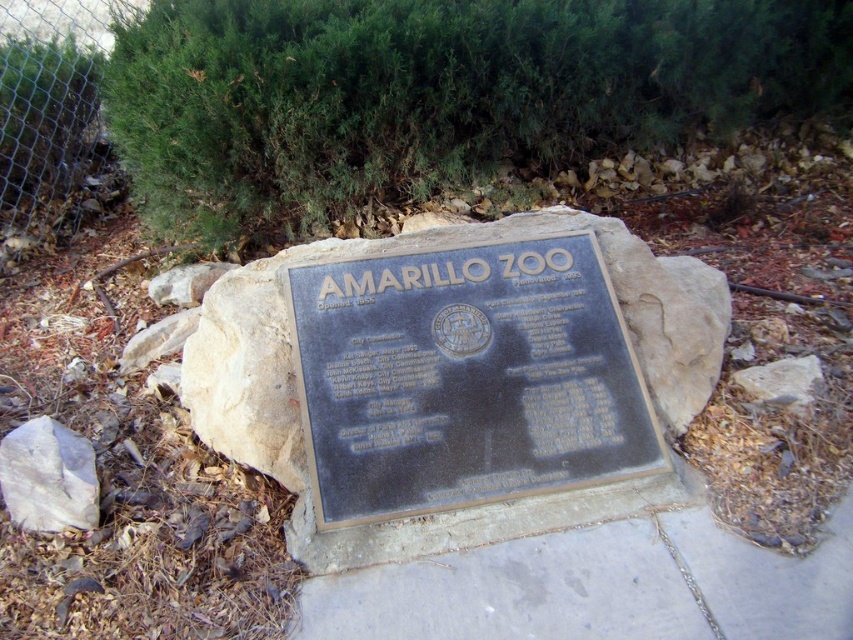
You are a zoo visitor trying to take a photo of the bronze plaque at center and the metal mesh fence at upper left. Which object will appear smaller in your photo?

The bronze plaque at center will appear smaller in the photo because it occupies less space than the metal mesh fence at upper left.

You are a landscape architect designing a pathway near the plaque. You need to place a decorative stone between the green leafy bush at upper center and the gray concrete pavement at center. Which object should the stone be closer to if it must be placed closer to the wider one?

The green leafy bush at upper center is wider than the gray concrete pavement at center, so the decorative stone should be placed closer to the green leafy bush at upper center.

You are a maintenance worker needing to place a new plaque on the ground. The plaque must be placed on a surface that is higher than the other. Which object should you choose between the gray concrete pavement at center and the white rough rock at lower left?

The gray concrete pavement at center has a greater height compared to the white rough rock at lower left. Therefore, you should place the new plaque on the gray concrete pavement at center since it is higher.